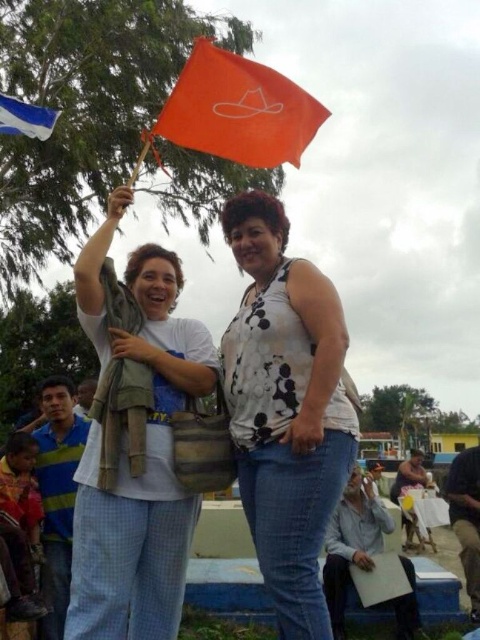
Can you confirm if white printed tank top at center is positioned above orange matte flag at upper center?

Actually, white printed tank top at center is below orange matte flag at upper center.

Who is more forward, (336, 296) or (264, 108)?

Point (336, 296) is more forward.

Does point (278, 224) come farther from viewer compared to point (239, 134)?

That is True.

You are a GUI agent. You are given a task and a screenshot of the screen. Output one action in this format:
    pyautogui.click(x=<x>, y=<y>)
    Task: Click on the white printed tank top at center
    The width and height of the screenshot is (480, 640).
    Given the screenshot: What is the action you would take?
    pyautogui.click(x=286, y=408)

Is point (196, 378) positioned in front of point (280, 161)?

Yes.

Identify the location of white cotton shirt at upper left. (144, 456).

Does white printed tank top at center have a lesser width compared to blue fabric flag at upper left?

No, white printed tank top at center is not thinner than blue fabric flag at upper left.

Does white printed tank top at center appear on the right side of blue fabric flag at upper left?

Correct, you'll find white printed tank top at center to the right of blue fabric flag at upper left.

Who is more forward, (x=261, y=275) or (x=13, y=125)?

Point (x=261, y=275)

Locate an element on the screen. This screenshot has width=480, height=640. white printed tank top at center is located at coordinates (286, 408).